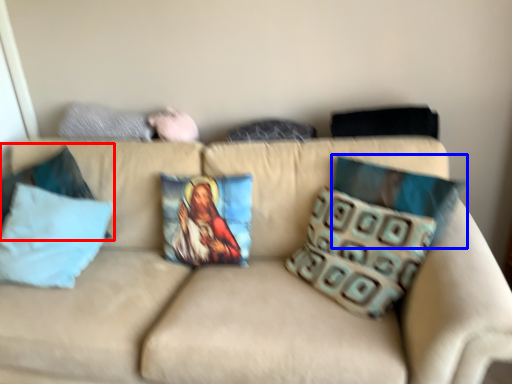
Question: Which object appears farthest to the camera in this image, pillow (highlighted by a red box) or pillow (highlighted by a blue box)?

Choices:
 (A) pillow
 (B) pillow

Answer: (A)